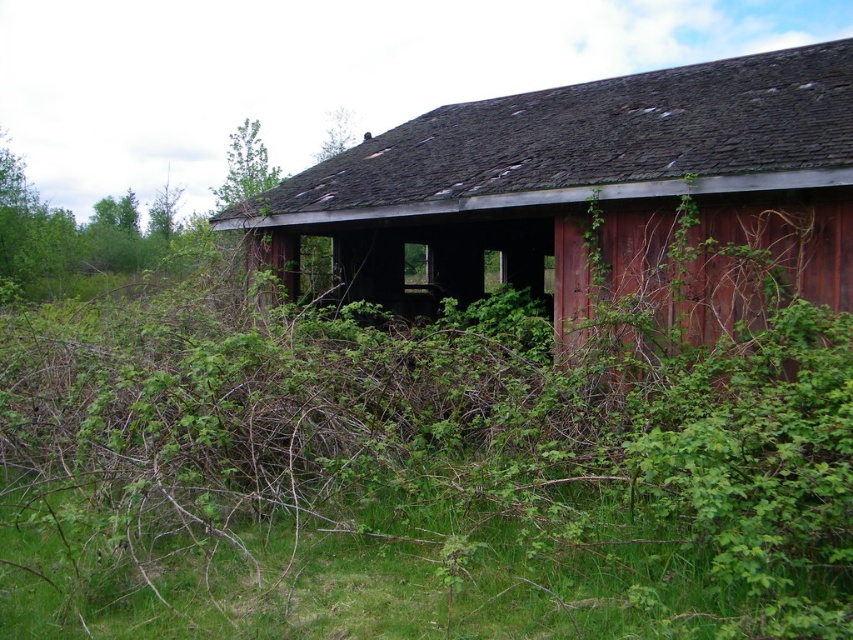
You are a painter standing at the edge of the field. You need to paint both the rusty wood barn at center and the green leafy tree at upper left. Which object should you paint first if you want to start with the larger one?

The green leafy tree at upper left is larger than the rusty wood barn at center, so you should paint the green leafy tree at upper left first.

You are standing outside the rusty wood barn at center and want to take a photo of the green leafy tree at upper left. Since the barn is blocking your view, can you move to the right to get a clear shot?

The rusty wood barn at center is in front of the green leafy tree at upper left, so moving to the right might allow you to position yourself around the barn to capture the tree without obstruction.